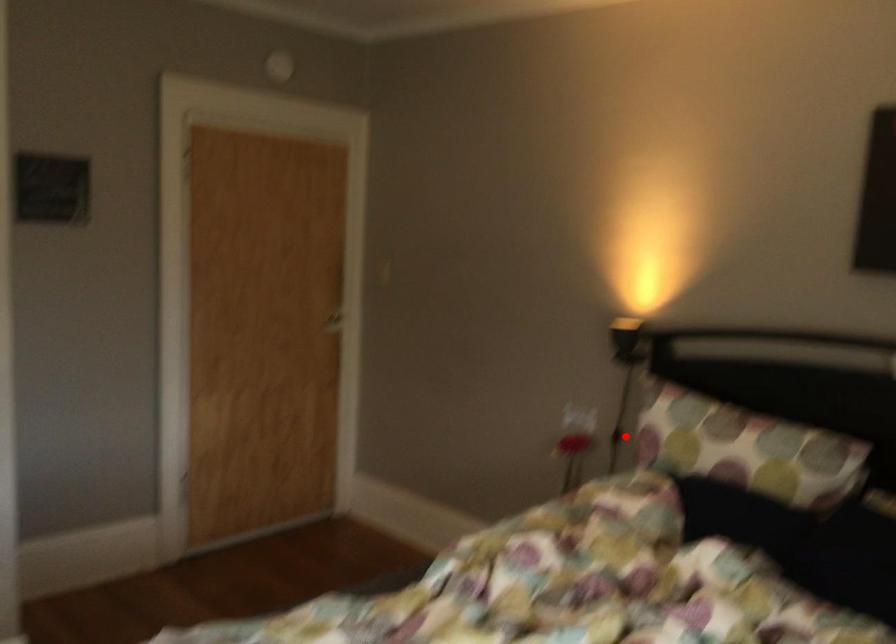
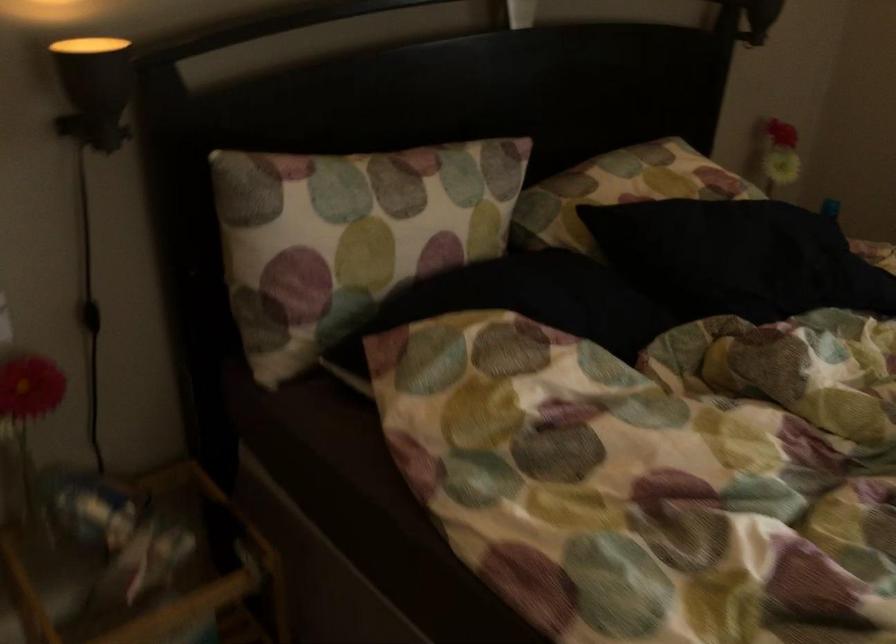
Locate, in the second image, the point that corresponds to the highlighted location in the first image.

(90, 316)